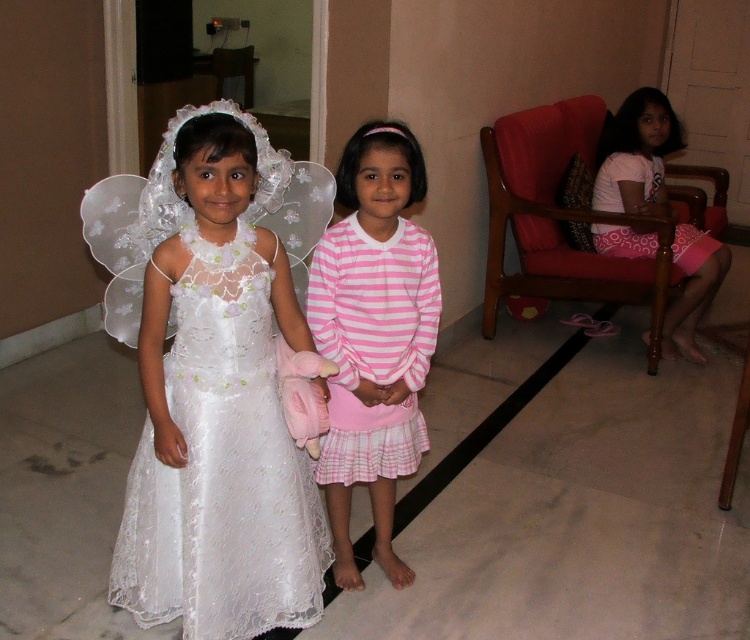
Between white lace dress at left and pink fabric dress at right, which one appears on the left side from the viewer's perspective?

Positioned to the left is white lace dress at left.

Is the position of white lace dress at left less distant than that of pink fabric dress at right?

Yes, white lace dress at left is closer to the viewer.

Which is behind, point (306, 532) or point (662, 104)?

The point (662, 104) is more distant.

Image resolution: width=750 pixels, height=640 pixels. Identify the location of white lace dress at left. (220, 461).

Between pink striped dress at center and pink fabric dress at right, which one has more height?

Standing taller between the two is pink fabric dress at right.

Find the location of a particular element. The width and height of the screenshot is (750, 640). pink striped dress at center is located at coordinates (374, 336).

What do you see at coordinates (374, 336) in the screenshot?
I see `pink striped dress at center` at bounding box center [374, 336].

At what (x,y) coordinates should I click in order to perform the action: click on pink striped dress at center. Please return your answer as a coordinate pair (x, y). The image size is (750, 640). Looking at the image, I should click on (374, 336).

Is white lace dress at left to the left of pink striped dress at center from the viewer's perspective?

Correct, you'll find white lace dress at left to the left of pink striped dress at center.

Consider the image. Is white lace dress at left closer to the viewer compared to pink striped dress at center?

That is True.

Describe the element at coordinates (220, 461) in the screenshot. Image resolution: width=750 pixels, height=640 pixels. I see `white lace dress at left` at that location.

Locate an element on the screen. The height and width of the screenshot is (640, 750). white lace dress at left is located at coordinates (220, 461).